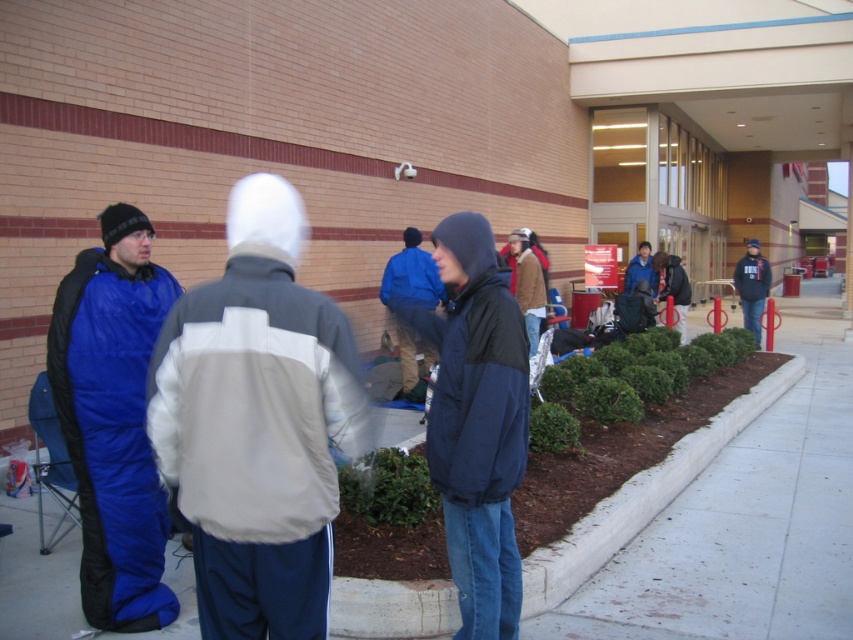
Can you confirm if blue sleeping bag at left is taller than dark blue jacket at center?

Yes, blue sleeping bag at left is taller than dark blue jacket at center.

Who is higher up, blue sleeping bag at left or dark blue jacket at center?

blue sleeping bag at left

Is point (105, 426) in front of point (445, 376)?

That is False.

What are the coordinates of `blue sleeping bag at left` in the screenshot? It's located at (113, 419).

Identify the location of dark blue jacket at center. This screenshot has height=640, width=853. (477, 422).

How far apart are dark blue jacket at center and dark gray hoodie at center?

10.25 meters

Describe the element at coordinates (477, 422) in the screenshot. The image size is (853, 640). I see `dark blue jacket at center` at that location.

Identify the location of dark blue jacket at center. Image resolution: width=853 pixels, height=640 pixels. (477, 422).

Consider the image. Does blue fleece jacket at center appear on the left side of dark gray hoodie at center?

Yes, blue fleece jacket at center is to the left of dark gray hoodie at center.

Is blue fleece jacket at center smaller than dark gray hoodie at center?

Yes, blue fleece jacket at center is smaller than dark gray hoodie at center.

Identify the location of blue fleece jacket at center. (410, 276).